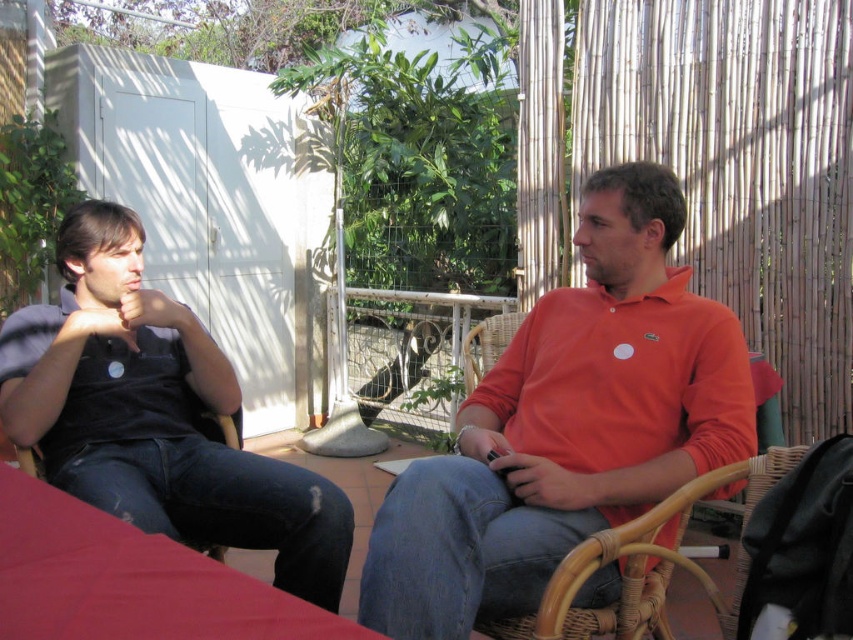
Question: Which of the following is the farthest from the observer?

Choices:
 (A) smooth red table at lower left
 (B) orange cotton polo shirt at right
 (C) brown woven chair at left
 (D) woven rattan chair at right

Answer: (C)

Question: Is the position of dark blue denim jeans at left less distant than that of woven rattan chair at right?

Choices:
 (A) no
 (B) yes

Answer: (A)

Question: Considering the relative positions of smooth red table at lower left and woven rattan chair at right in the image provided, where is smooth red table at lower left located with respect to woven rattan chair at right?

Choices:
 (A) right
 (B) left

Answer: (B)

Question: Which point is closer to the camera?

Choices:
 (A) (122, 529)
 (B) (28, 468)
 (C) (757, 488)

Answer: (A)

Question: Is dark blue denim jeans at left smaller than woven rattan chair at right?

Choices:
 (A) no
 (B) yes

Answer: (A)

Question: Which object appears farthest from the camera in this image?

Choices:
 (A) brown woven chair at left
 (B) orange cotton polo shirt at right
 (C) dark blue denim jeans at left

Answer: (A)